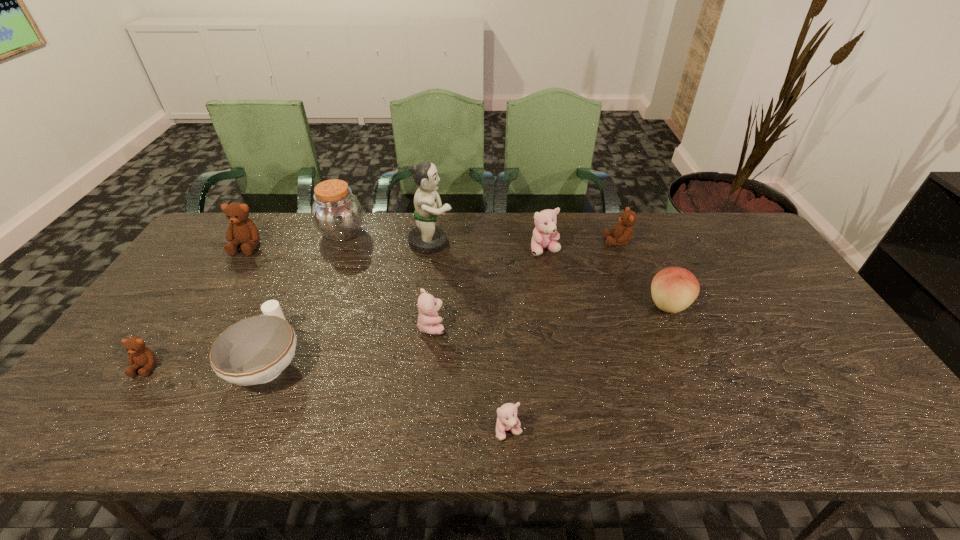
Find the location of `free space that satisfies the following two spatial constraints: 1. on the face of the peach; 2. on the left side of the rightmost brown teddy bear`. free space that satisfies the following two spatial constraints: 1. on the face of the peach; 2. on the left side of the rightmost brown teddy bear is located at coordinates (641, 305).

I want to click on free spot that satisfies the following two spatial constraints: 1. at the face of the rightmost pink teddy bear; 2. at the face of the second farthest pink teddy bear, so click(x=559, y=326).